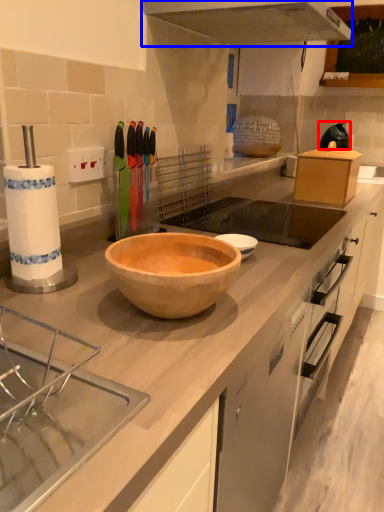
Question: Which point is further to the camera, appliance (highlighted by a red box) or exhaust hood (highlighted by a blue box)?

Choices:
 (A) appliance
 (B) exhaust hood

Answer: (A)